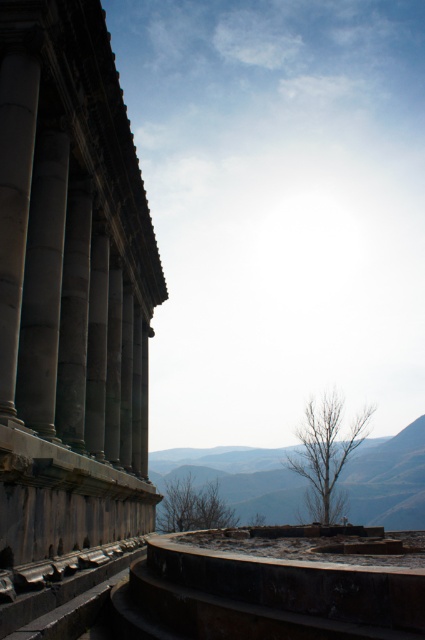
You are a hiker planning to take a photo of the gray stone mountain at center and the slate gray stone column at left from a distance. Which object should you focus on first if you want to capture both in a single frame without zooming in?

The gray stone mountain at center is wider than the slate gray stone column at left, so you should focus on the gray stone mountain at center first to ensure it fits within the frame before adjusting for the smaller column.

You are an architect examining the temple structure. You notice two columns on the left side of the image. Which column has a greater width between the slate gray stone column at left and the smooth stone column at left?

The slate gray stone column at left has a greater width than the smooth stone column at left according to the description.

You are standing at the base of the ancient temple structure and notice two points marked on the curved stone wall. The first point is located at coordinates point (51, 195) and the second at point (33, 67). Which point is closer to your current position?

Point (51, 195) is further to the camera than point (33, 67), so the point (33, 67) is closer to your current position.